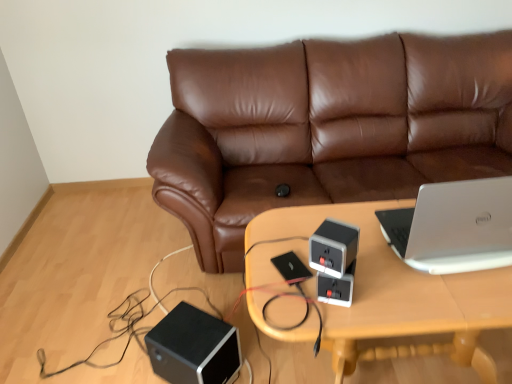
Where is `vacant area in front of silver metallic laptop at right`? vacant area in front of silver metallic laptop at right is located at coordinates [456, 293].